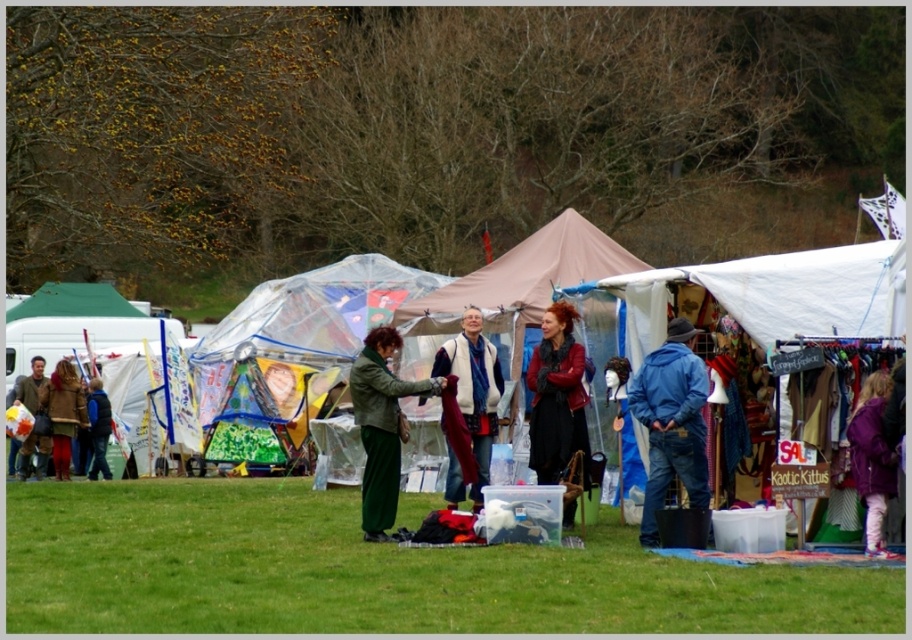
You are taking a photo of the outdoor market and want to focus on both the point at (x=553, y=358) and the point at (x=496, y=420). Which point should you focus on first to ensure both are in focus?

You should focus on the point at (x=553, y=358) first because it is closer to the camera than the point at (x=496, y=420), ensuring both points will be in focus when using a proper depth of field.

Looking at this image, you are a photographer at the market and want to capture both the green matte jacket at center and the matte brown jacket at left in a single photo. Which jacket should you focus on to ensure both are in frame without moving the camera?

The green matte jacket at center is taller than the matte brown jacket at left, so focusing on the green matte jacket at center would ensure both are in frame as it is the taller one and likely occupies a central position.